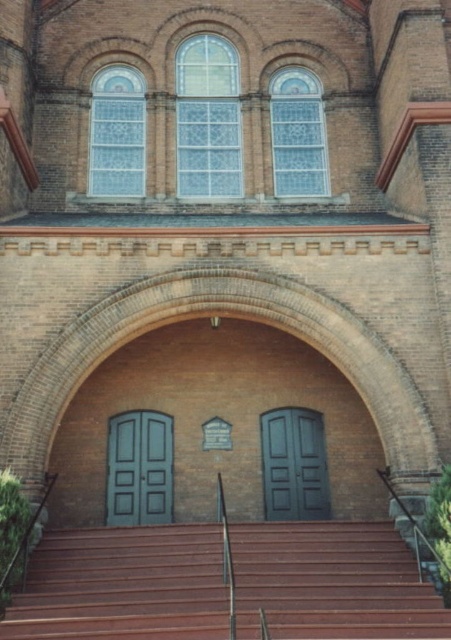
Question: Where is brown wooden stairs at center located in relation to teal glossy door at center in the image?

Choices:
 (A) left
 (B) right

Answer: (B)

Question: Based on their relative distances, which object is farther from the teal glossy door at center?

Choices:
 (A) brown wooden stairs at center
 (B) matte black door at center

Answer: (A)

Question: Can you confirm if teal glossy door at center is positioned above matte black door at center?

Choices:
 (A) no
 (B) yes

Answer: (B)

Question: Which object appears closest to the camera in this image?

Choices:
 (A) teal glossy door at center
 (B) brown wooden stairs at center
 (C) matte black door at center

Answer: (B)

Question: Does teal glossy door at center have a smaller size compared to matte black door at center?

Choices:
 (A) yes
 (B) no

Answer: (B)

Question: Among these points, which one is farthest from the camera?

Choices:
 (A) (304, 502)
 (B) (307, 605)
 (C) (170, 420)

Answer: (C)